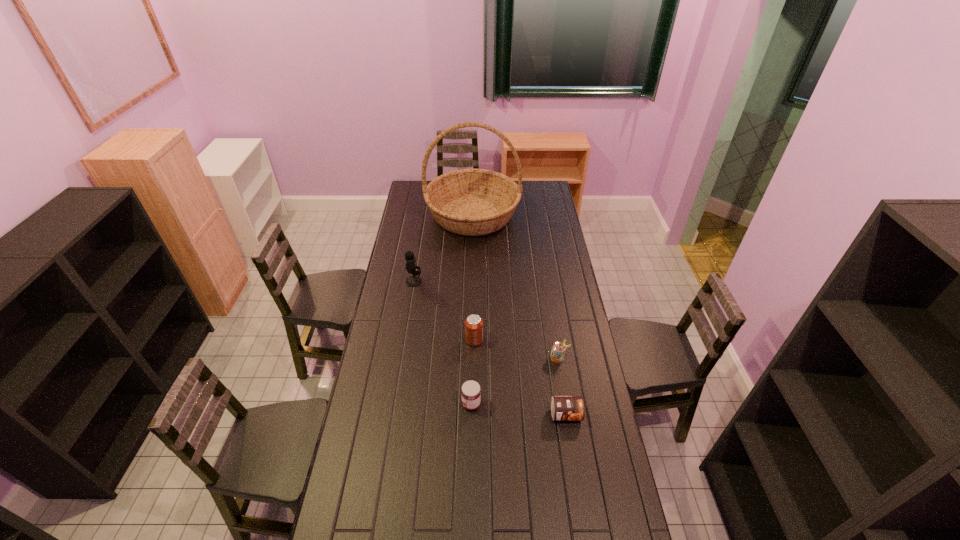
The width and height of the screenshot is (960, 540). I want to click on object that is positioned at the far left corner, so click(471, 202).

Locate an element on the screen. This screenshot has height=540, width=960. free region at the left edge of the desktop is located at coordinates click(403, 325).

Locate an element on the screen. This screenshot has width=960, height=540. vacant space at the right edge is located at coordinates pyautogui.click(x=548, y=214).

Where is `free location at the far left corner of the desktop`? free location at the far left corner of the desktop is located at coordinates (421, 200).

Where is `vacant space that is in between the second tallest can and the tallest can`? Image resolution: width=960 pixels, height=540 pixels. vacant space that is in between the second tallest can and the tallest can is located at coordinates (516, 349).

At what (x,y) coordinates should I click in order to perform the action: click on empty space that is in between the leftmost can and the farthest object. Please return your answer as a coordinate pair (x, y). Looking at the image, I should click on (473, 278).

Locate an element on the screen. blank region between the tallest object and the farthest can is located at coordinates (473, 278).

The height and width of the screenshot is (540, 960). What are the coordinates of `free spot between the fifth shortest object and the jam` in the screenshot? It's located at (443, 343).

You are a GUI agent. You are given a task and a screenshot of the screen. Output one action in this format:
    pyautogui.click(x=<x>, y=<y>)
    Task: Click on the unoccupied area between the nearest can and the tallest object
    
    Given the screenshot: What is the action you would take?
    click(519, 315)

The height and width of the screenshot is (540, 960). I want to click on free space between the farthest can and the tallest object, so click(473, 278).